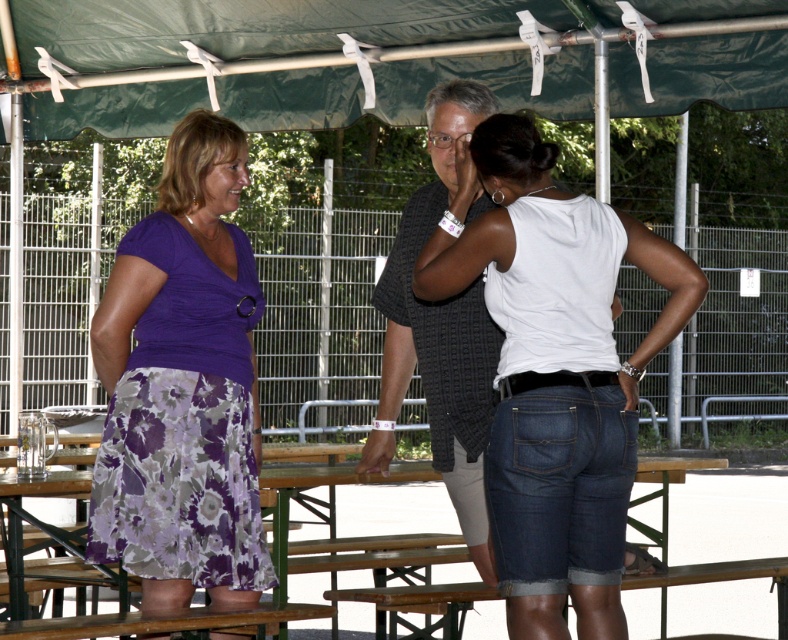
You are planning to hang a string of fairy lights from the green fabric canopy at upper center to the wooden picnic table at center. Considering their heights, will the lights reach the table without needing to be adjusted?

The green fabric canopy at upper center is taller than the wooden picnic table at center, so the fairy lights hung from it will naturally reach the table without needing adjustment.

You are at the picnic area and want to greet the person wearing the purple floral skirt at left. Which direction should you walk from the person wearing the white matte tank top at center?

The white matte tank top at center is to the right of the purple floral skirt at left. To reach the purple floral skirt at left from the white matte tank top at center, you should walk to the left.